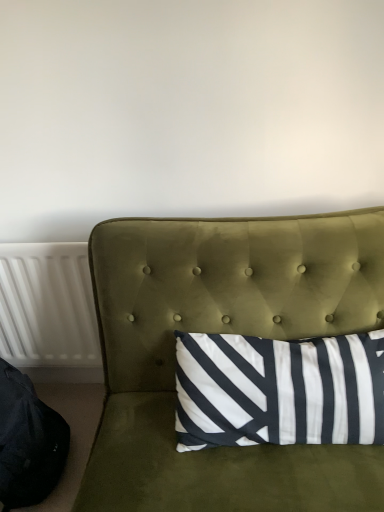
Image resolution: width=384 pixels, height=512 pixels. What are the coordinates of `velvet green studio couch at center` in the screenshot? It's located at (225, 332).

Find the location of `black fabric bean bag chair at lower left`. black fabric bean bag chair at lower left is located at coordinates (28, 441).

Could you tell me if white plastic radiator at left is facing velvet green studio couch at center?

No, white plastic radiator at left is not facing towards velvet green studio couch at center.

Is white plastic radiator at left far from velvet green studio couch at center?

white plastic radiator at left is near velvet green studio couch at center, not far away.

From the image's perspective, is white plastic radiator at left under velvet green studio couch at center?

Actually, white plastic radiator at left appears above velvet green studio couch at center in the image.

Is black fabric bean bag chair at lower left bigger or smaller than velvet green studio couch at center?

Clearly, black fabric bean bag chair at lower left is smaller in size than velvet green studio couch at center.

Does point (38, 482) appear closer or farther from the camera than point (118, 238)?

Clearly, point (38, 482) is more distant from the camera than point (118, 238).

Based on the photo, which object is closer to the camera taking this photo, black fabric bean bag chair at lower left or velvet green studio couch at center?

velvet green studio couch at center is in front.

From the image's perspective, who appears lower, black fabric bean bag chair at lower left or velvet green studio couch at center?

From the image's view, black fabric bean bag chair at lower left is below.

In the scene shown: How many degrees apart are the facing directions of velvet green studio couch at center and black fabric bean bag chair at lower left?

70 degrees.

Is point (193, 267) closer or farther from the camera than point (0, 443)?

Point (193, 267) is positioned closer to the camera compared to point (0, 443).

Is velvet green studio couch at center at the left side of black fabric bean bag chair at lower left?

Incorrect, velvet green studio couch at center is not on the left side of black fabric bean bag chair at lower left.

I want to click on studio couch above the black fabric bean bag chair at lower left (from the image's perspective), so click(225, 332).

Considering the sizes of black fabric bean bag chair at lower left and white plastic radiator at left in the image, is black fabric bean bag chair at lower left wider or thinner than white plastic radiator at left?

black fabric bean bag chair at lower left is wider than white plastic radiator at left.

Is black fabric bean bag chair at lower left oriented away from white plastic radiator at left?

No, black fabric bean bag chair at lower left is not facing the opposite direction of white plastic radiator at left.

Between black fabric bean bag chair at lower left and white plastic radiator at left, which one is positioned in front?

black fabric bean bag chair at lower left is more forward.

In order to click on radiator behind the black fabric bean bag chair at lower left in this screenshot , I will do `click(47, 306)`.

In the image, is white plastic radiator at left positioned in front of or behind black fabric bean bag chair at lower left?

In the image, white plastic radiator at left appears behind black fabric bean bag chair at lower left.

Is white plastic radiator at left oriented away from black fabric bean bag chair at lower left?

Absolutely, white plastic radiator at left is directed away from black fabric bean bag chair at lower left.

Which point is more forward, [5,298] or [5,366]?

Point [5,366]

Does white plastic radiator at left have a lesser height compared to black fabric bean bag chair at lower left?

In fact, white plastic radiator at left may be taller than black fabric bean bag chair at lower left.

Measure the distance from velvet green studio couch at center to white plastic radiator at left.

velvet green studio couch at center and white plastic radiator at left are 18.01 inches apart from each other.

In the scene shown: Would you say velvet green studio couch at center is inside or outside white plastic radiator at left?

velvet green studio couch at center is outside white plastic radiator at left.

Is velvet green studio couch at center oriented away from white plastic radiator at left?

No.

Which of these two, velvet green studio couch at center or white plastic radiator at left, is smaller?

white plastic radiator at left.

You are a GUI agent. You are given a task and a screenshot of the screen. Output one action in this format:
    pyautogui.click(x=<x>, y=<y>)
    Task: Click on the radiator below the velvet green studio couch at center (from a real-world perspective)
    
    Given the screenshot: What is the action you would take?
    pyautogui.click(x=47, y=306)

In order to click on bean bag chair to the left of velvet green studio couch at center in this screenshot , I will do `click(28, 441)`.

Which object lies nearer to the anchor point black fabric bean bag chair at lower left, white plastic radiator at left or velvet green studio couch at center?

white plastic radiator at left is positioned closer to the anchor black fabric bean bag chair at lower left.

Looking at the image, which one is located closer to black fabric bean bag chair at lower left, velvet green studio couch at center or white plastic radiator at left?

white plastic radiator at left.

Based on their spatial positions, is black fabric bean bag chair at lower left or white plastic radiator at left further from velvet green studio couch at center?

The object further to velvet green studio couch at center is black fabric bean bag chair at lower left.

From the image, which object appears to be farther from velvet green studio couch at center, white plastic radiator at left or black fabric bean bag chair at lower left?

black fabric bean bag chair at lower left.

Looking at the image, which one is located further to white plastic radiator at left, black fabric bean bag chair at lower left or velvet green studio couch at center?

Based on the image, velvet green studio couch at center appears to be further to white plastic radiator at left.

From the image, which object appears to be nearer to white plastic radiator at left, velvet green studio couch at center or black fabric bean bag chair at lower left?

Based on the image, black fabric bean bag chair at lower left appears to be nearer to white plastic radiator at left.

Where is `bean bag chair between velvet green studio couch at center and white plastic radiator at left in the front-back direction`? bean bag chair between velvet green studio couch at center and white plastic radiator at left in the front-back direction is located at coordinates (28, 441).